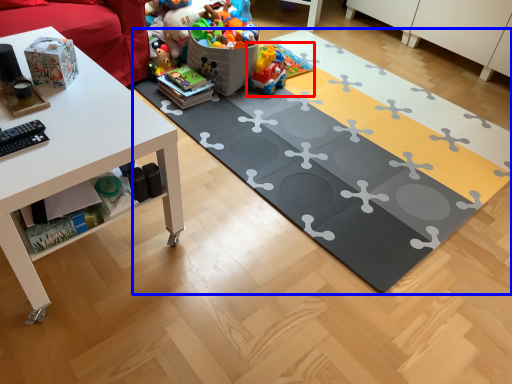
Question: Which object is further to the camera taking this photo, toy (highlighted by a red box) or yoga mat (highlighted by a blue box)?

Choices:
 (A) toy
 (B) yoga mat

Answer: (A)